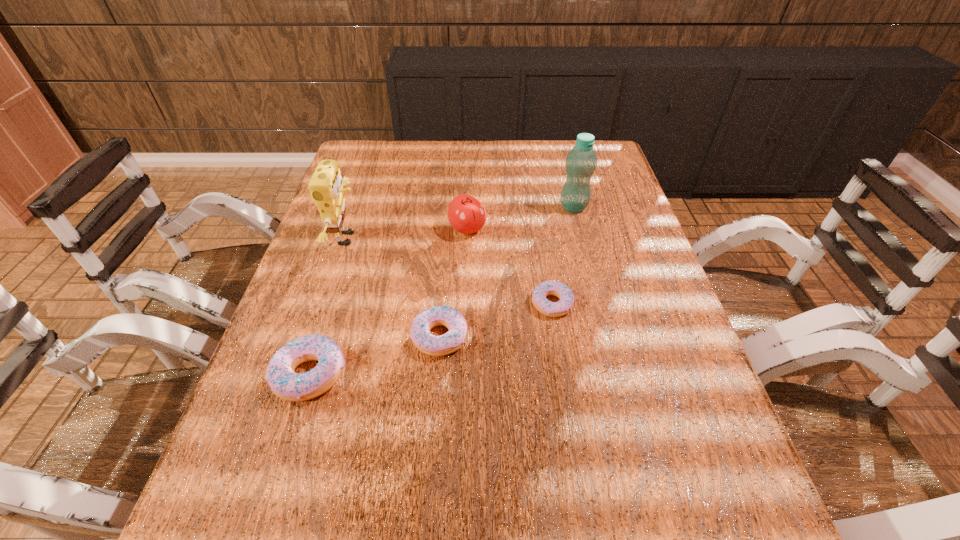
Please point a spot on the right to add another doughnut. Please provide its 2D coordinates. Your answer should be formatted as a tuple, i.e. [(x, y)], where the tuple contains the x and y coordinates of a point satisfying the conditions above.

[(651, 275)]